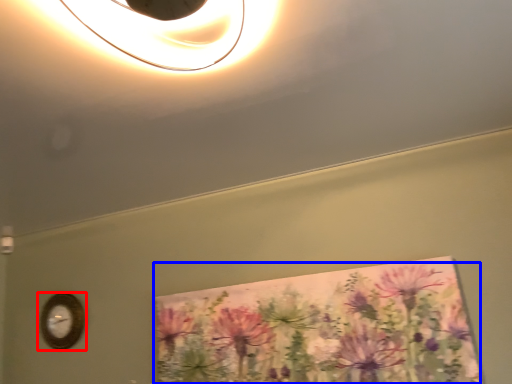
Question: Which object is further to the camera taking this photo, wall clock (highlighted by a red box) or flower (highlighted by a blue box)?

Choices:
 (A) wall clock
 (B) flower

Answer: (A)